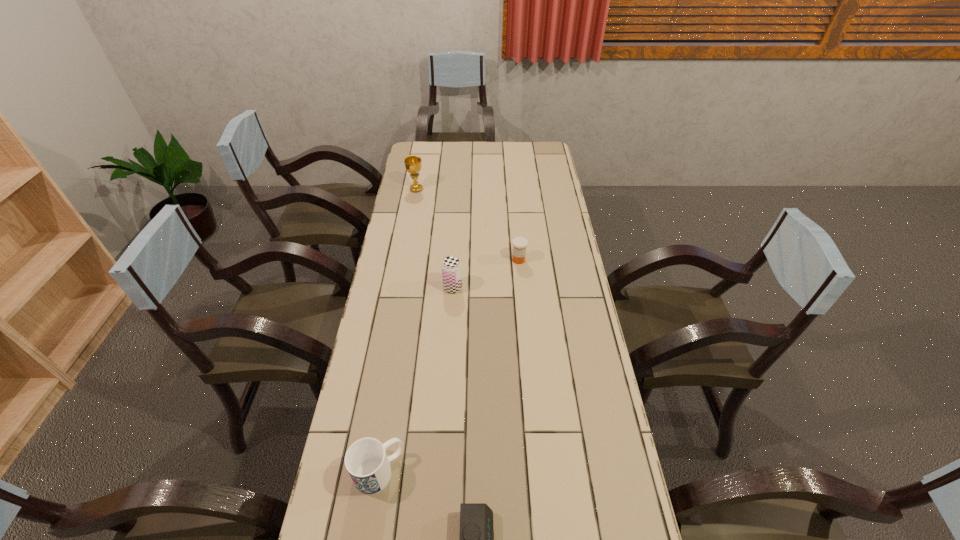
Where is `empty location between the mug and the tallest object`? empty location between the mug and the tallest object is located at coordinates (397, 330).

Identify the location of unoccupied area between the farthest object and the fourth farthest object. This screenshot has height=540, width=960. (397, 330).

The image size is (960, 540). I want to click on free space between the rightmost object and the farthest object, so click(468, 225).

I want to click on empty location between the beer can and the chalice, so click(x=435, y=239).

The image size is (960, 540). In order to click on free spot between the mug and the third object from right to left in this screenshot , I will do `click(416, 380)`.

Image resolution: width=960 pixels, height=540 pixels. I want to click on the second closest object relative to the fourth farthest object, so click(x=451, y=266).

Identify which object is the third nearest to the third nearest object. Please provide its 2D coordinates. Your answer should be formatted as a tuple, i.e. [(x, y)], where the tuple contains the x and y coordinates of a point satisfying the conditions above.

[(366, 461)]